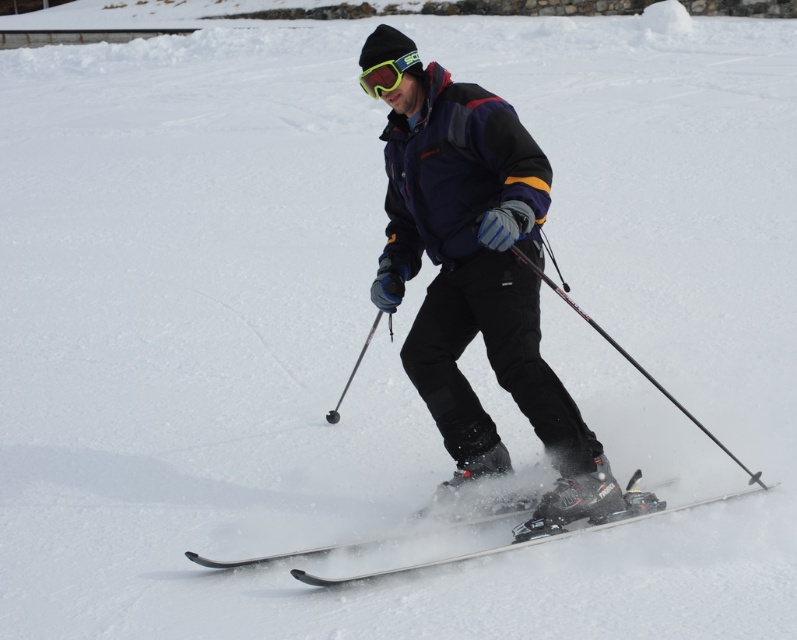
Does matte blue ski jacket at center come behind green reflective plastic goggles at center?

No.

Does matte blue ski jacket at center have a lesser width compared to green reflective plastic goggles at center?

No.

Who is more distant from viewer, [406,340] or [398,61]?

The point [406,340] is behind.

At what (x,y) coordinates should I click in order to perform the action: click on matte blue ski jacket at center. Please return your answer as a coordinate pair (x, y). Image resolution: width=797 pixels, height=640 pixels. Looking at the image, I should click on (479, 284).

Does white glossy skis at center appear on the right side of green reflective plastic goggles at center?

Yes, white glossy skis at center is to the right of green reflective plastic goggles at center.

Can you confirm if white glossy skis at center is positioned to the left of green reflective plastic goggles at center?

Incorrect, white glossy skis at center is not on the left side of green reflective plastic goggles at center.

You are a GUI agent. You are given a task and a screenshot of the screen. Output one action in this format:
    pyautogui.click(x=<x>, y=<y>)
    Task: Click on the white glossy skis at center
    
    Given the screenshot: What is the action you would take?
    pyautogui.click(x=529, y=540)

In order to click on white glossy skis at center in this screenshot , I will do `click(529, 540)`.

Can you confirm if white glossy skis at center is taller than black textured ski pole at center?

No.

Is point (375, 573) less distant than point (701, 422)?

Yes, point (375, 573) is closer to viewer.

Where is `white glossy skis at center`? This screenshot has width=797, height=640. white glossy skis at center is located at coordinates (529, 540).